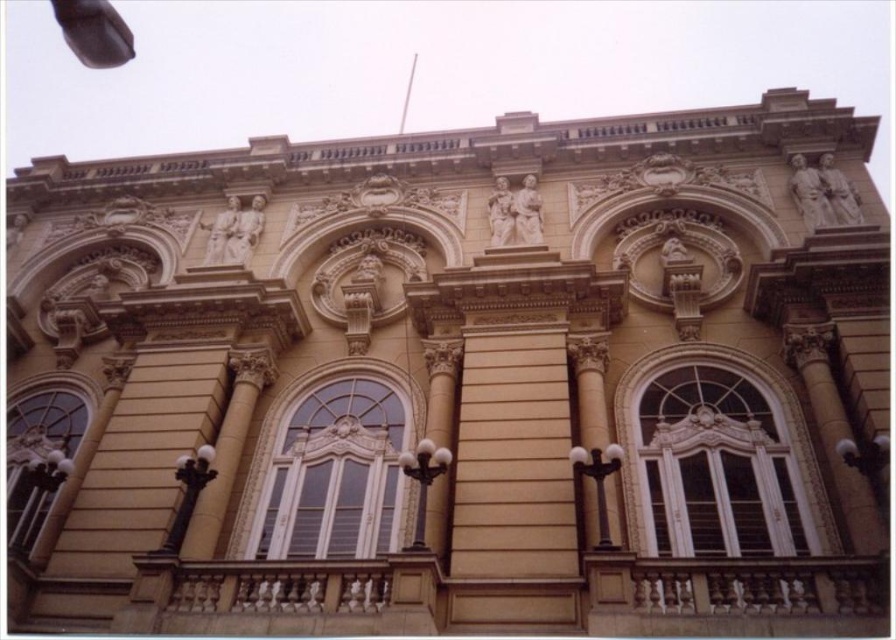
Can you confirm if white glossy window at center is positioned above matte glass window at lower left?

Yes.

How much distance is there between white glossy window at center and matte glass window at lower left?

They are 44.40 meters apart.

At what (x,y) coordinates should I click in order to perform the action: click on white glossy window at center. Please return your answer as a coordinate pair (x, y). This screenshot has height=640, width=896. Looking at the image, I should click on tap(716, 467).

The height and width of the screenshot is (640, 896). What do you see at coordinates (39, 458) in the screenshot?
I see `matte glass window at lower left` at bounding box center [39, 458].

Can you confirm if matte glass window at lower left is taller than golden stone column at center?

No, matte glass window at lower left is not taller than golden stone column at center.

What do you see at coordinates (39, 458) in the screenshot?
I see `matte glass window at lower left` at bounding box center [39, 458].

This screenshot has width=896, height=640. I want to click on matte glass window at lower left, so click(x=39, y=458).

Who is more forward, [795,531] or [571,340]?

Point [795,531] is in front.

Between point (788, 538) and point (602, 365), which one is positioned behind?

The point (602, 365) is behind.

Does point (807, 541) come in front of point (591, 540)?

No, (807, 541) is further to viewer.

The image size is (896, 640). I want to click on white glossy window at center, so click(x=716, y=467).